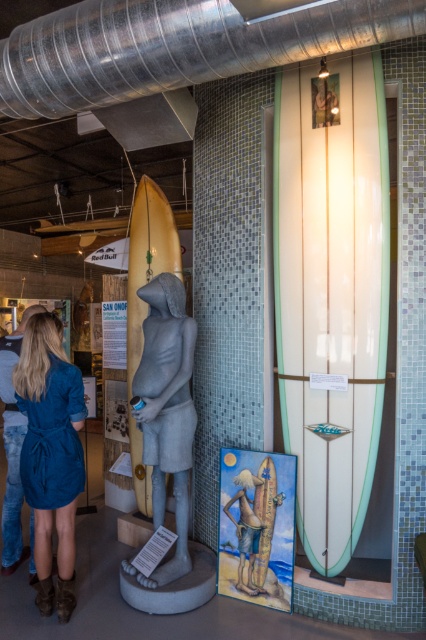
Is green glossy surfboard at center closer to camera compared to gray stone statue at center?

Yes, it is in front of gray stone statue at center.

Where is `green glossy surfboard at center`? The image size is (426, 640). green glossy surfboard at center is located at coordinates (331, 291).

You are a GUI agent. You are given a task and a screenshot of the screen. Output one action in this format:
    pyautogui.click(x=<x>, y=<y>)
    Task: Click on the green glossy surfboard at center
    The image size is (426, 640).
    Given the screenshot: What is the action you would take?
    pyautogui.click(x=331, y=291)

What do you see at coordinates (331, 291) in the screenshot?
I see `green glossy surfboard at center` at bounding box center [331, 291].

Can you confirm if green glossy surfboard at center is taller than beige fabric surfboard at center?

Yes.

Locate an element on the screen. The height and width of the screenshot is (640, 426). green glossy surfboard at center is located at coordinates (331, 291).

In order to click on green glossy surfboard at center in this screenshot , I will do `click(331, 291)`.